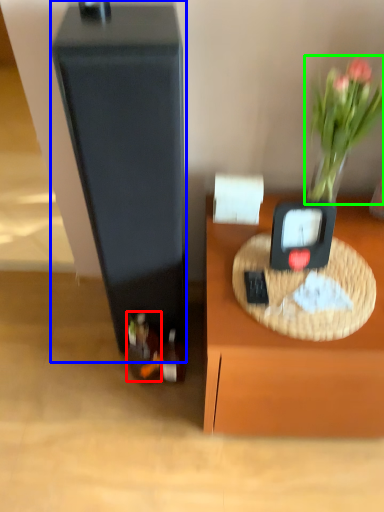
Question: Which object is positioned closest to wine bottle (highlighted by a red box)? Select from wide (highlighted by a blue box) and plant (highlighted by a green box).

Choices:
 (A) wide
 (B) plant

Answer: (A)